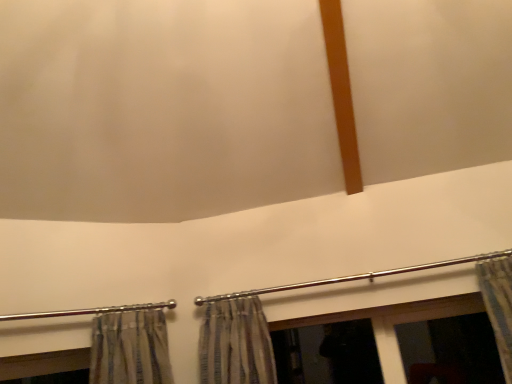
Identify the location of vacant area on top of polished metal rod at center, marked as the first clothesline in a right-to-left arrangement (from a real-world perspective). The image size is (512, 384). (362, 258).